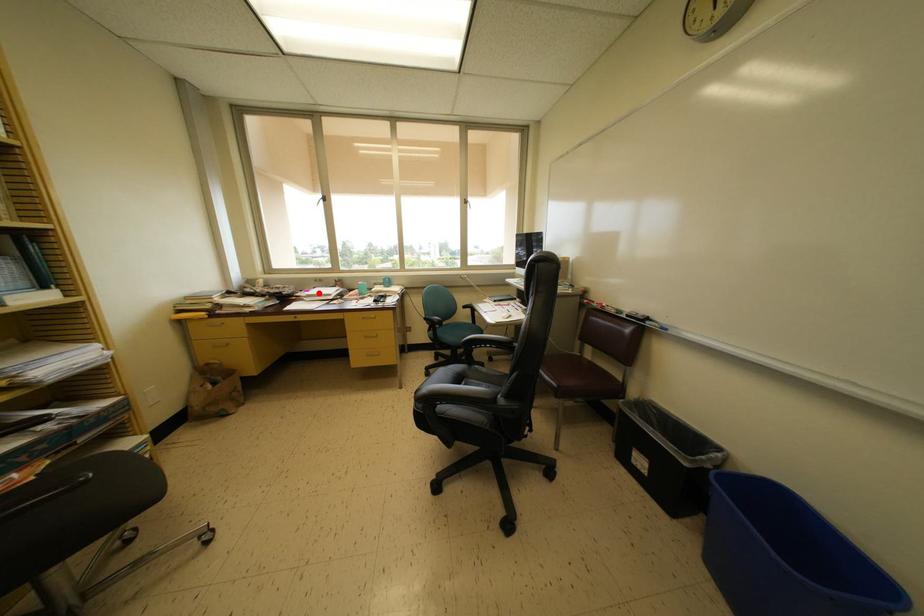
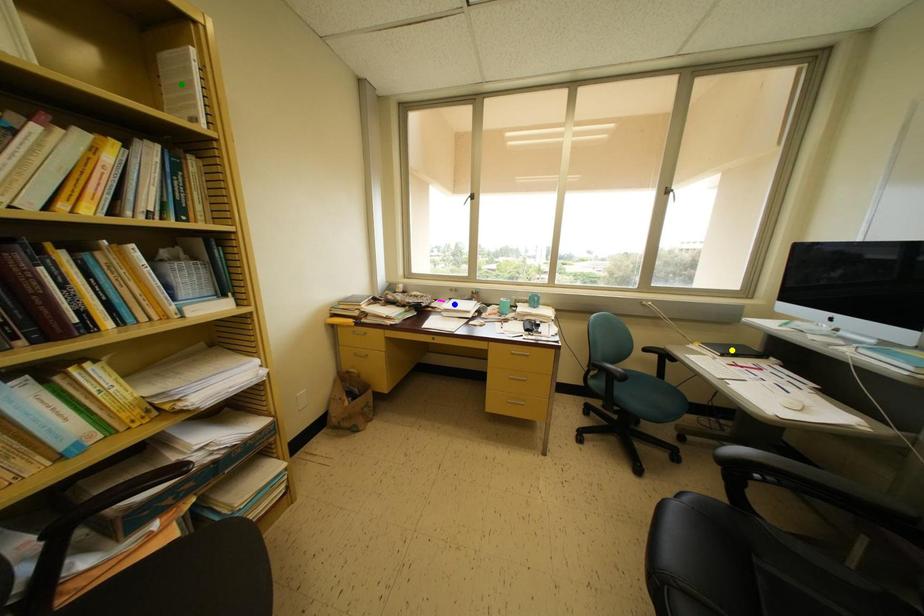
Question: I am providing you with two images of the same scene from different viewpoints. A red point is marked on the first image. You are given multiple points on the second image. Which point in image 2 is actually the same real-world point as the red point in image 1?

Choices:
 (A) green point
 (B) blue point
 (C) yellow point

Answer: (B)